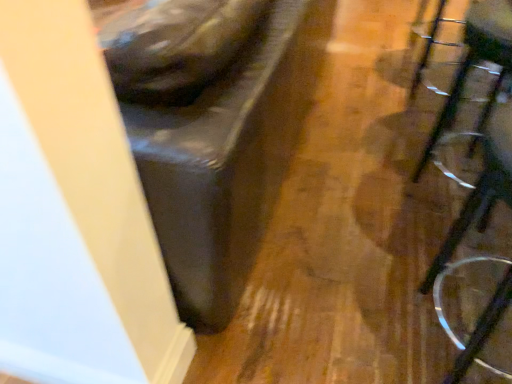
The height and width of the screenshot is (384, 512). Describe the element at coordinates (475, 60) in the screenshot. I see `clear plastic swivel chair at right` at that location.

Measure the distance between clear plastic swivel chair at right and camera.

A distance of 34.80 inches exists between clear plastic swivel chair at right and camera.

You are a GUI agent. You are given a task and a screenshot of the screen. Output one action in this format:
    pyautogui.click(x=<x>, y=<y>)
    Task: Click on the clear plastic swivel chair at right
    This screenshot has width=512, height=384.
    Given the screenshot: What is the action you would take?
    pyautogui.click(x=475, y=60)

Based on the photo, measure the distance between point (501, 27) and camera.

Point (501, 27) and camera are 1.07 meters apart.

In order to face clear plastic glasses at right, should I rotate leftwards or rightwards?

To align with it, rotate right about 31.301°.

What is the approximate width of clear plastic glasses at right?

The width of clear plastic glasses at right is 12.44 inches.

Describe the element at coordinates (478, 124) in the screenshot. Image resolution: width=512 pixels, height=384 pixels. I see `clear plastic glasses at right` at that location.

In order to click on clear plastic glasses at right in this screenshot , I will do `click(478, 124)`.

You are a GUI agent. You are given a task and a screenshot of the screen. Output one action in this format:
    pyautogui.click(x=<x>, y=<y>)
    Task: Click on the clear plastic swivel chair at right
    Image resolution: width=512 pixels, height=384 pixels.
    Given the screenshot: What is the action you would take?
    pyautogui.click(x=475, y=60)

Does clear plastic swivel chair at right appear on the left side of clear plastic glasses at right?

Incorrect, clear plastic swivel chair at right is not on the left side of clear plastic glasses at right.

Considering the relative positions of clear plastic swivel chair at right and clear plastic glasses at right in the image provided, is clear plastic swivel chair at right behind clear plastic glasses at right?

Yes, clear plastic swivel chair at right is further from the viewer.

Is point (509, 31) closer to viewer compared to point (470, 195)?

Yes, it is.

From the image's perspective, is clear plastic swivel chair at right beneath clear plastic glasses at right?

No.

From a real-world perspective, which is physically below, clear plastic swivel chair at right or clear plastic glasses at right?

In real-world perspective, clear plastic swivel chair at right is lower.

Considering the sizes of objects clear plastic swivel chair at right and clear plastic glasses at right in the image provided, who is wider, clear plastic swivel chair at right or clear plastic glasses at right?

clear plastic swivel chair at right.

Between clear plastic swivel chair at right and clear plastic glasses at right, which one has more height?

clear plastic glasses at right.

Does clear plastic swivel chair at right have a larger size compared to clear plastic glasses at right?

Actually, clear plastic swivel chair at right might be smaller than clear plastic glasses at right.

Is clear plastic swivel chair at right spatially inside clear plastic glasses at right, or outside of it?

clear plastic swivel chair at right is not inside clear plastic glasses at right, it's outside.

Consider the image. Are clear plastic swivel chair at right and clear plastic glasses at right making contact?

No, clear plastic swivel chair at right is not in contact with clear plastic glasses at right.

Is clear plastic glasses at right at the back of clear plastic swivel chair at right?

clear plastic swivel chair at right is not turned away from clear plastic glasses at right.

In the image, there is a clear plastic glasses at right. Find the location of `swivel chair below it (from a real-world perspective)`. swivel chair below it (from a real-world perspective) is located at coordinates (475, 60).

Does clear plastic glasses at right appear on the left side of clear plastic swivel chair at right?

Yes, clear plastic glasses at right is to the left of clear plastic swivel chair at right.

In the image, is clear plastic glasses at right positioned in front of or behind clear plastic swivel chair at right?

clear plastic glasses at right is positioned closer to the viewer than clear plastic swivel chair at right.

Between point (502, 160) and point (474, 28), which one is positioned behind?

The point (474, 28) is farther.

From the image's perspective, would you say clear plastic glasses at right is shown under clear plastic swivel chair at right?

Indeed, from the image's perspective, clear plastic glasses at right is shown beneath clear plastic swivel chair at right.

From a real-world perspective, which is physically below, clear plastic glasses at right or clear plastic swivel chair at right?

clear plastic swivel chair at right is physically lower.

Between clear plastic glasses at right and clear plastic swivel chair at right, which one has larger width?

With larger width is clear plastic swivel chair at right.

Considering the sizes of clear plastic glasses at right and clear plastic swivel chair at right in the image, is clear plastic glasses at right taller or shorter than clear plastic swivel chair at right?

Considering their sizes, clear plastic glasses at right has more height than clear plastic swivel chair at right.

Which of these two, clear plastic glasses at right or clear plastic swivel chair at right, is smaller?

Smaller between the two is clear plastic swivel chair at right.

Can we say clear plastic glasses at right lies outside clear plastic swivel chair at right?

clear plastic glasses at right lies outside clear plastic swivel chair at right's area.

Is clear plastic glasses at right not near clear plastic swivel chair at right?

No, clear plastic glasses at right is not far from clear plastic swivel chair at right.

Is clear plastic glasses at right aimed at clear plastic swivel chair at right?

No, clear plastic glasses at right is not facing towards clear plastic swivel chair at right.

Locate an element on the screen. The height and width of the screenshot is (384, 512). furniture that appears above the clear plastic swivel chair at right (from a real-world perspective) is located at coordinates (478, 124).

The height and width of the screenshot is (384, 512). Find the location of `furniture lying in front of the clear plastic swivel chair at right`. furniture lying in front of the clear plastic swivel chair at right is located at coordinates (478, 124).

This screenshot has width=512, height=384. I want to click on furniture above the clear plastic swivel chair at right (from a real-world perspective), so click(478, 124).